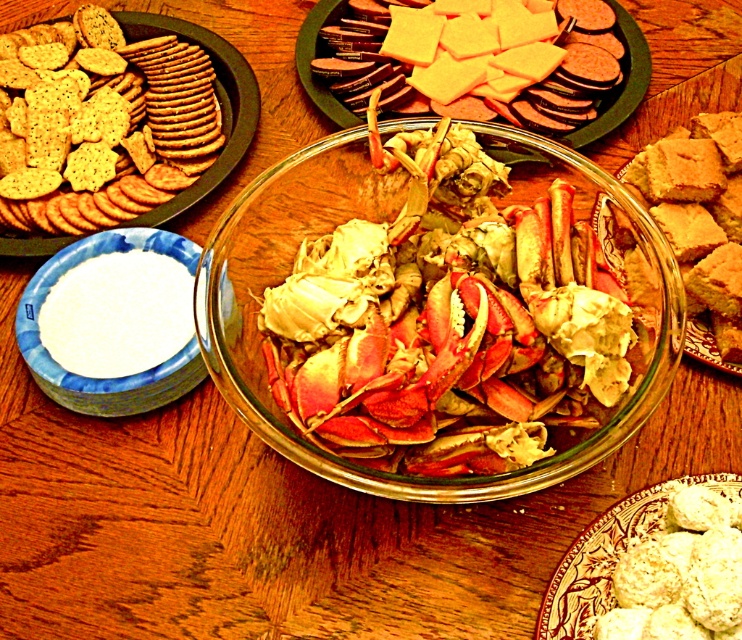
You are a food photographer setting up a shot of the scene. The white crumbly at lower right is important for the composition. Where should you place your camera to best capture its position?

→ The white crumbly at lower right is located at coordinates point (608, 556), so position the camera to focus on that point to best capture its position.

You are a food stylist arranging items on a table. You need to place a decorative plate at coordinates point 0.5, 0.6. Is the shiny red crab at center currently in the way?

The shiny red crab at center is located at point (446, 317), which is very close to the desired coordinates of (444, 320). Therefore, it may be obstructing the placement of the decorative plate at that location.